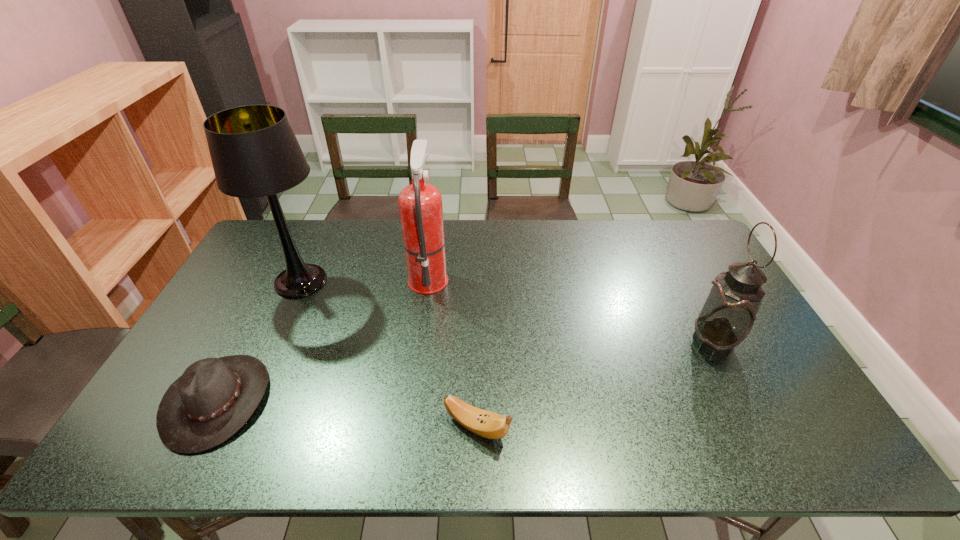
Where is `table lamp that is at the far edge`? table lamp that is at the far edge is located at coordinates click(254, 151).

Image resolution: width=960 pixels, height=540 pixels. In order to click on fire extinguisher located at the far edge in this screenshot , I will do `click(420, 204)`.

Where is `banana that is at the near edge`? The width and height of the screenshot is (960, 540). banana that is at the near edge is located at coordinates (484, 423).

Where is `hat that is positioned at the near edge`? hat that is positioned at the near edge is located at coordinates (214, 398).

Locate an element on the screen. table lamp positioned at the left edge is located at coordinates (254, 151).

Image resolution: width=960 pixels, height=540 pixels. What are the coordinates of `hat that is at the left edge` in the screenshot? It's located at (214, 398).

Identify the location of object that is at the right edge. (728, 314).

Identify the location of object situated at the far left corner. Image resolution: width=960 pixels, height=540 pixels. (254, 151).

This screenshot has width=960, height=540. Find the location of `object located at the near left corner`. object located at the near left corner is located at coordinates (214, 398).

In the image, there is a desktop. Where is `vacant space at the far edge`? vacant space at the far edge is located at coordinates (556, 231).